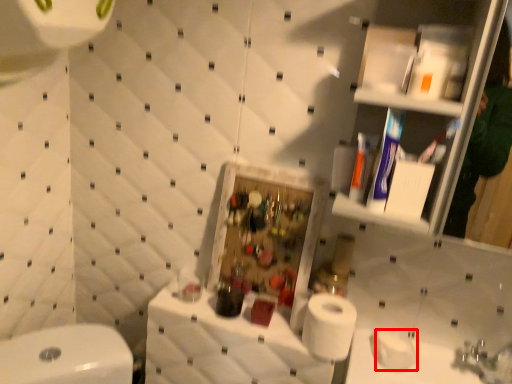
Question: From the image, what is the correct spatial relationship of toilet paper (annotated by the red box) in relation to counter top?

Choices:
 (A) right
 (B) left

Answer: (A)